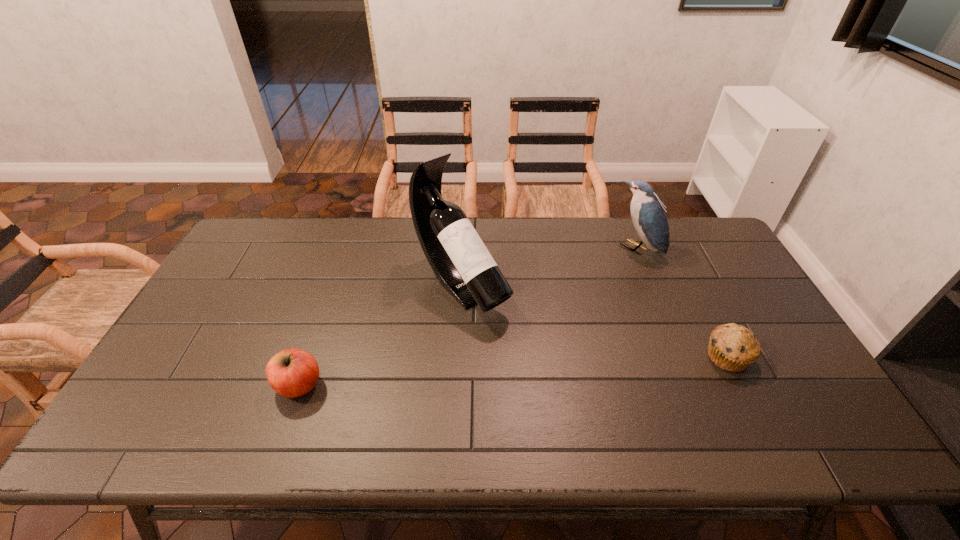
Find the location of a particular element. The height and width of the screenshot is (540, 960). apple is located at coordinates (291, 373).

This screenshot has height=540, width=960. I want to click on the third tallest object, so click(x=291, y=373).

Find the location of a particular element. muffin is located at coordinates (733, 348).

Find the location of a particular element. wine bottle is located at coordinates (463, 265).

The width and height of the screenshot is (960, 540). Find the location of `the tallest object`. the tallest object is located at coordinates (463, 265).

At what (x,y) coordinates should I click in order to perform the action: click on the second tallest object. Please return your answer as a coordinate pair (x, y). This screenshot has height=540, width=960. Looking at the image, I should click on (648, 214).

Where is `vacant space located on the left of the leftmost object`? The height and width of the screenshot is (540, 960). vacant space located on the left of the leftmost object is located at coordinates (219, 385).

Where is `vacant space situated 0.080m on the back of the shortest object`? The height and width of the screenshot is (540, 960). vacant space situated 0.080m on the back of the shortest object is located at coordinates (708, 317).

You are a GUI agent. You are given a task and a screenshot of the screen. Output one action in this format:
    pyautogui.click(x=<x>, y=<y>)
    Task: Click on the vacant space situated 0.080m on the stand of the wine bottle
    This screenshot has height=540, width=960.
    Given the screenshot: What is the action you would take?
    pyautogui.click(x=509, y=338)

This screenshot has width=960, height=540. Identify the location of vacant region located 0.340m on the stand of the wine bottle. (578, 406).